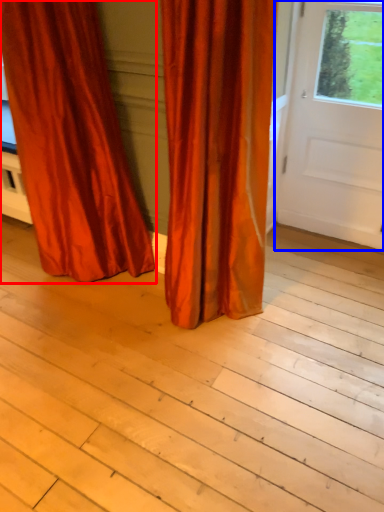
Question: Which point is closer to the camera, curtain (highlighted by a red box) or door (highlighted by a blue box)?

Choices:
 (A) curtain
 (B) door

Answer: (A)